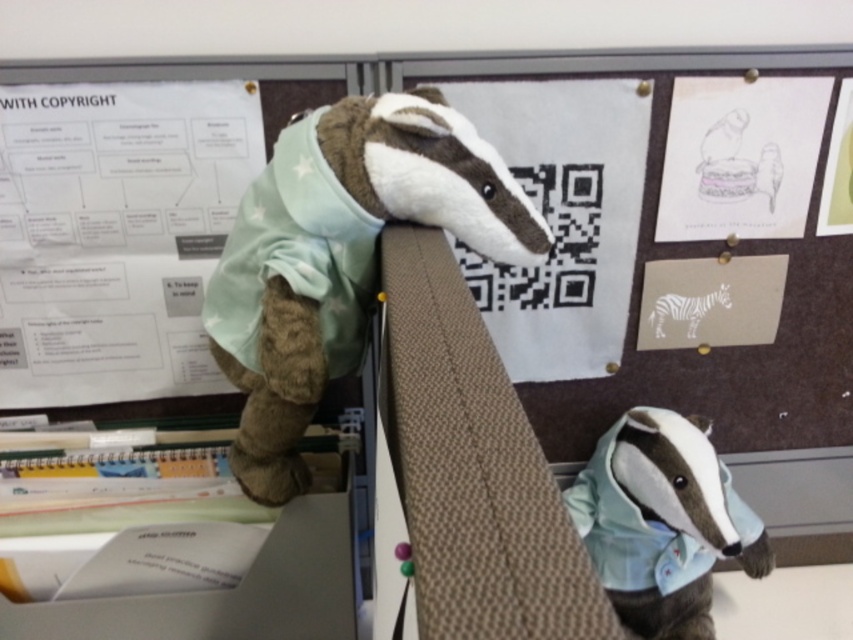
Can you confirm if white paper at center is wider than white paper at upper right?

Yes.

Can you confirm if white paper at center is positioned above white paper at upper right?

No.

Which is in front, point (538, 369) or point (695, 125)?

Positioned in front is point (695, 125).

The width and height of the screenshot is (853, 640). I want to click on white paper at center, so (561, 218).

Is fuzzy brown badger at upper left bigger than white paper at upper right?

Indeed, fuzzy brown badger at upper left has a larger size compared to white paper at upper right.

Is fuzzy brown badger at upper left further to the viewer compared to white paper at upper right?

That is False.

The width and height of the screenshot is (853, 640). What are the coordinates of `fuzzy brown badger at upper left` in the screenshot? It's located at (662, 522).

The width and height of the screenshot is (853, 640). What do you see at coordinates (341, 257) in the screenshot?
I see `fuzzy brown plush toy at upper center` at bounding box center [341, 257].

Where is `fuzzy brown plush toy at upper center`? fuzzy brown plush toy at upper center is located at coordinates (341, 257).

This screenshot has width=853, height=640. Find the location of `fuzzy brown plush toy at upper center`. fuzzy brown plush toy at upper center is located at coordinates (341, 257).